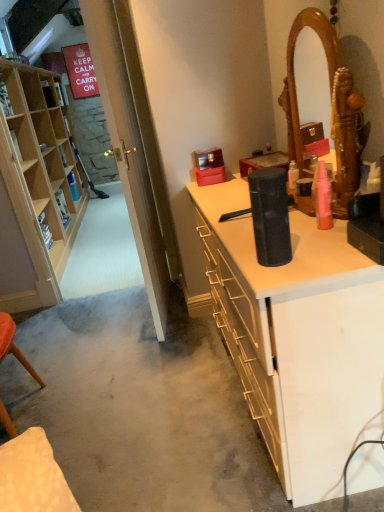
This screenshot has height=512, width=384. Identify the location of free spot to the left of transparent glass door at left. (124, 316).